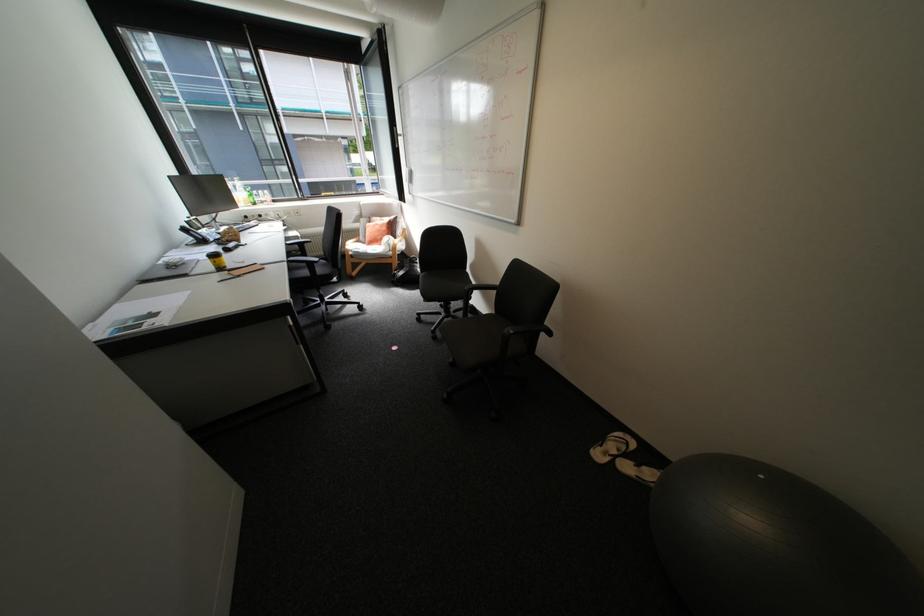
Find the location of a particular element. Image resolution: width=924 pixels, height=616 pixels. wooden chair armrest is located at coordinates click(399, 241).